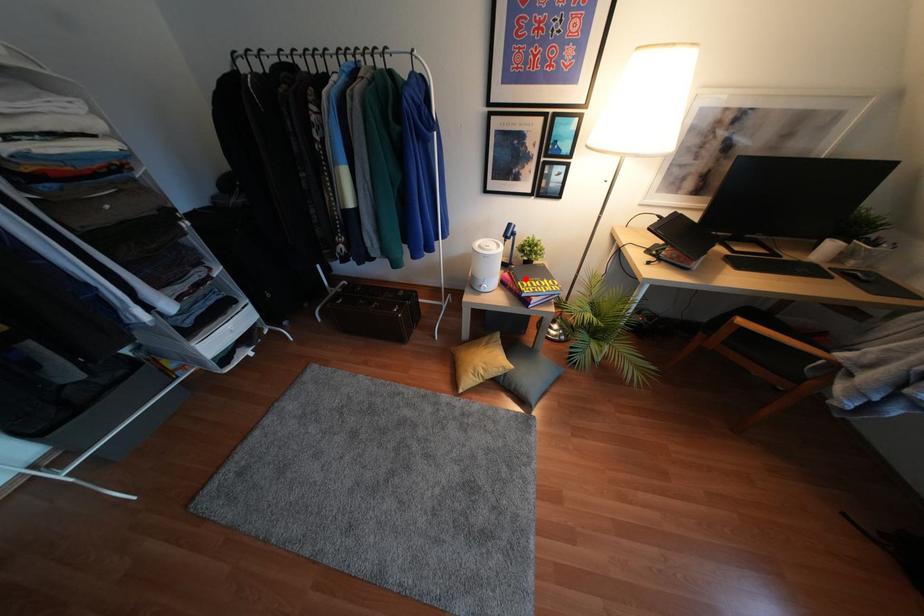
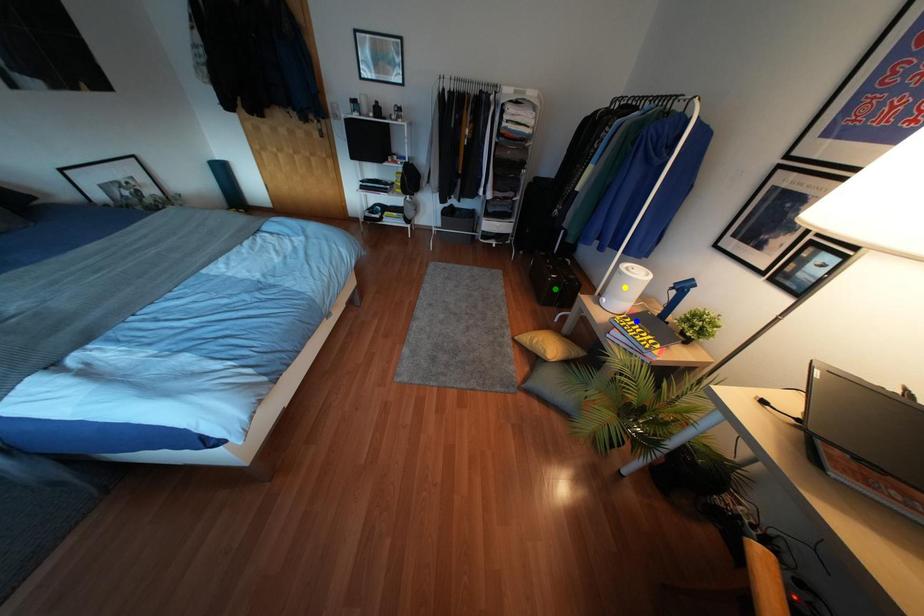
Question: I am providing you with two images of the same scene from different viewpoints. A red point is marked on the first image. You are given multiple points on the second image. In image 2, which mark is for the same physical point as the one in image 1?

Choices:
 (A) green point
 (B) yellow point
 (C) blue point

Answer: (C)